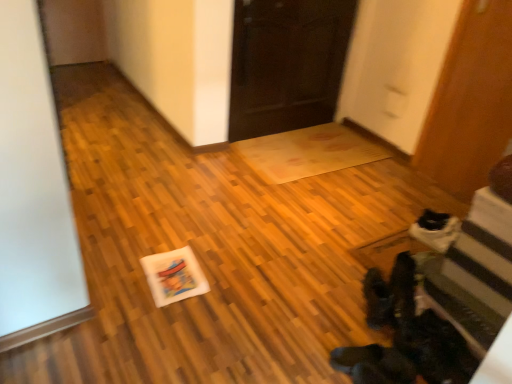
The image size is (512, 384). Identify the location of free point to the left of black suede boots at lower right. (332, 297).